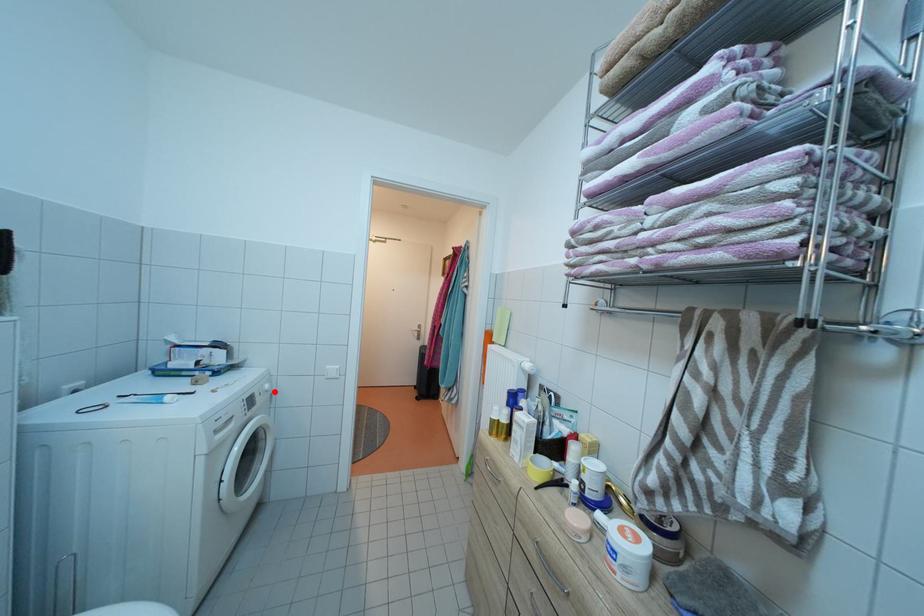
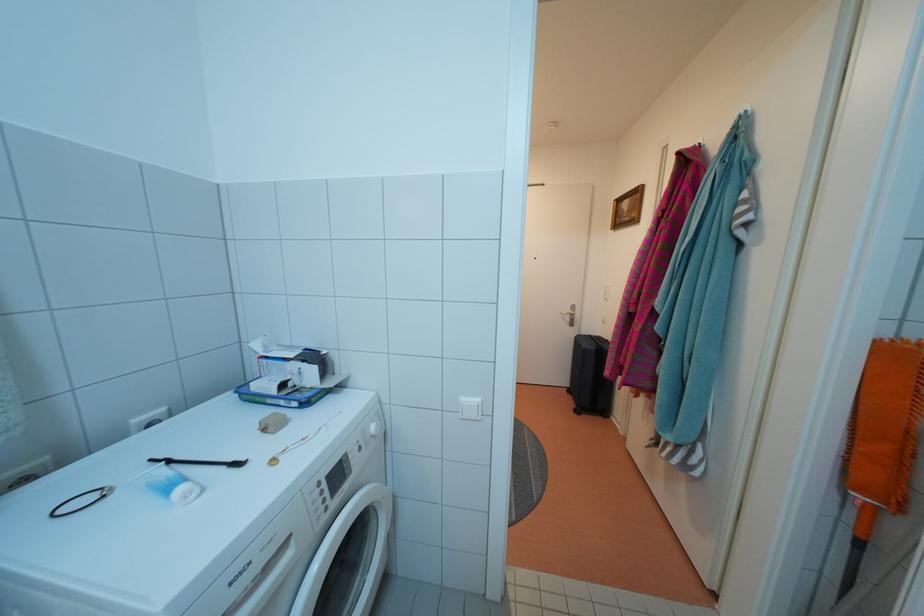
Find the pixel in the second image that matches the highlighted location in the first image.

(380, 434)